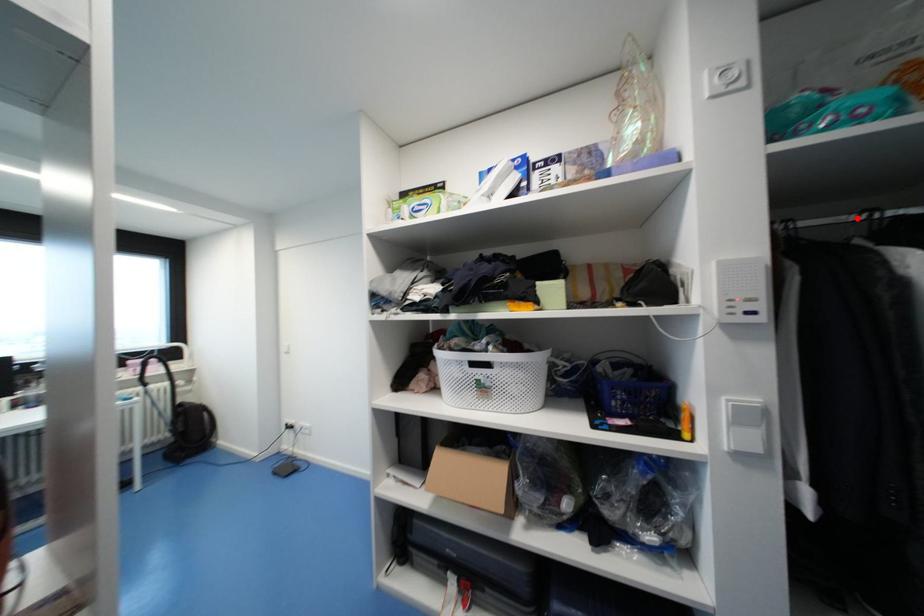
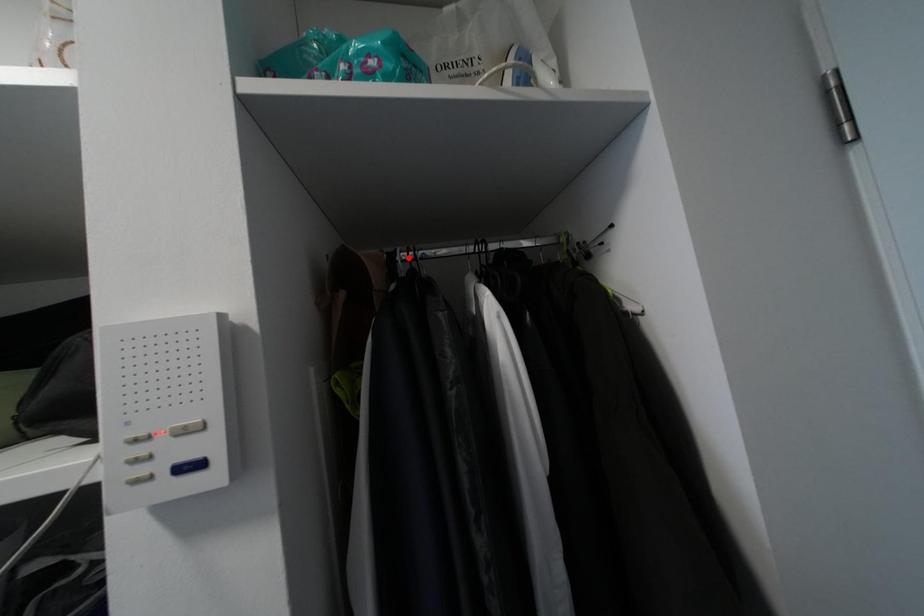
I am providing you with two images of the same scene from different viewpoints. A red point is marked on the first image and another point is marked on the second image. Is the red point in image1 aligned with the point shown in image2?

No